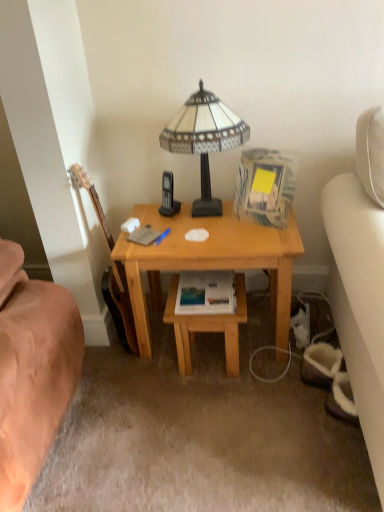
Locate an element on the screen. The height and width of the screenshot is (512, 384). vacant space that's between light brown wood table at center and wooden desk at center is located at coordinates tap(211, 370).